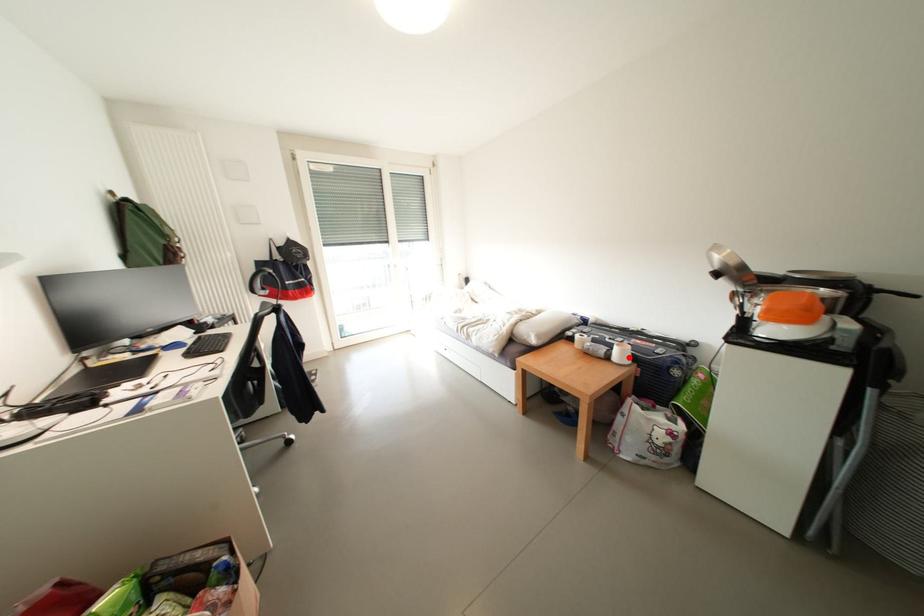
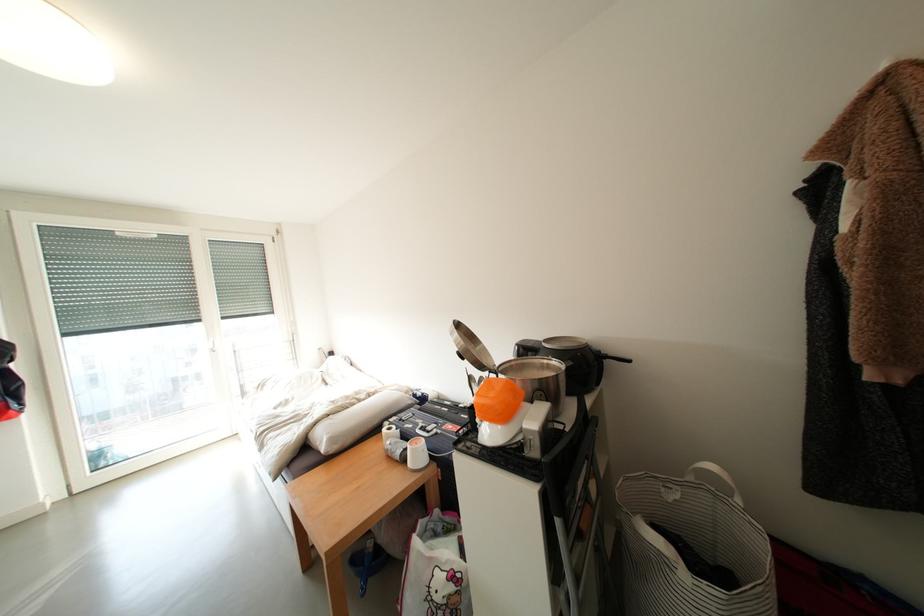
Locate, in the second image, the point that corresponds to the highlighted location in the first image.

(424, 456)